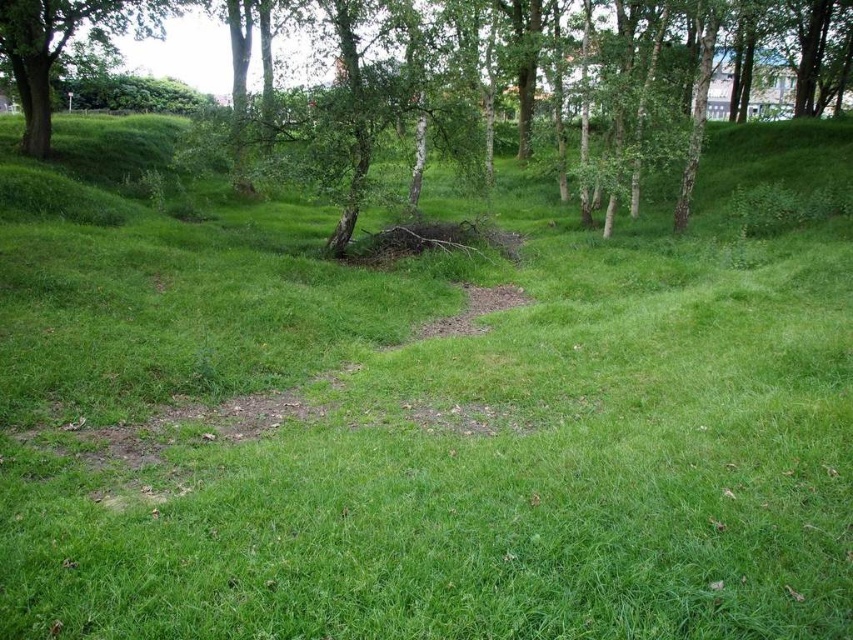
Question: Considering the relative positions of green leafy tree at upper center and green leafy tree at upper left in the image provided, where is green leafy tree at upper center located with respect to green leafy tree at upper left?

Choices:
 (A) right
 (B) left

Answer: (A)

Question: Is green leafy tree at upper center above green leafy tree at upper left?

Choices:
 (A) no
 (B) yes

Answer: (A)

Question: Does green leafy tree at upper center appear on the left side of green leafy tree at upper left?

Choices:
 (A) yes
 (B) no

Answer: (B)

Question: Which of the following is the farthest from the observer?

Choices:
 (A) (105, 17)
 (B) (647, 22)

Answer: (A)